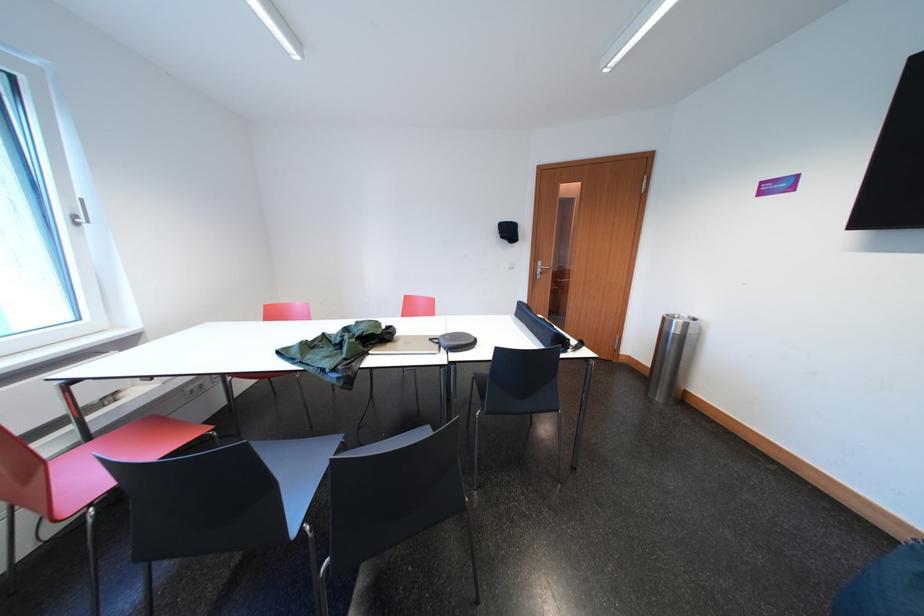
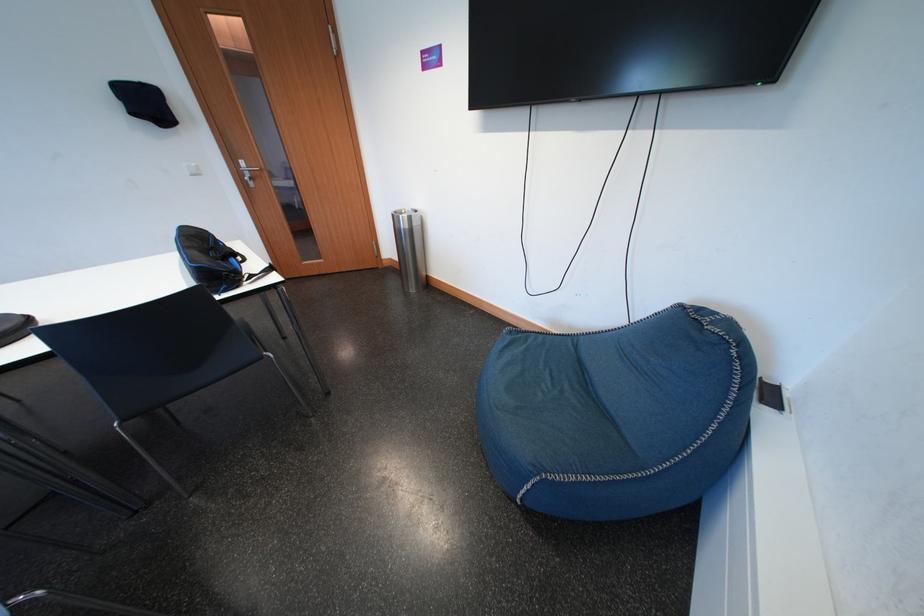
Based on the continuous images, in which direction is the camera rotating?

The camera rotated toward right-down.